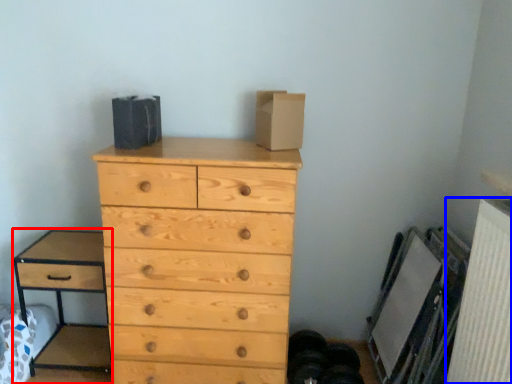
Question: Which object appears closest to the camera in this image, nightstand (highlighted by a red box) or radiator (highlighted by a blue box)?

Choices:
 (A) nightstand
 (B) radiator

Answer: (B)